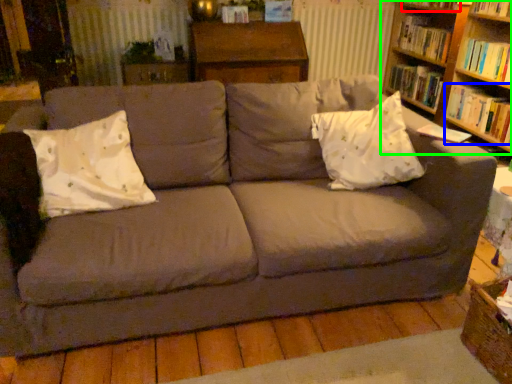
Question: Which object is the closest to the book (highlighted by a red box)? Choose among these: book (highlighted by a blue box) or bookcase (highlighted by a green box).

Choices:
 (A) book
 (B) bookcase

Answer: (B)